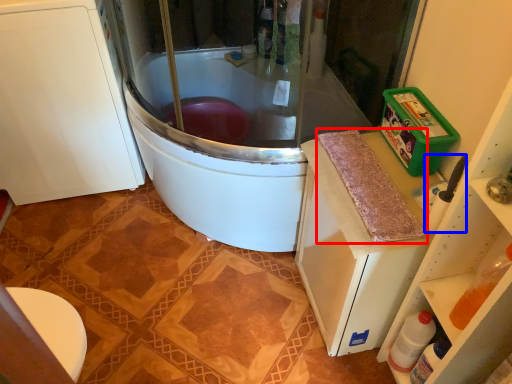
Question: Among these objects, which one is farthest to the camera, material (highlighted by a red box) or appliance (highlighted by a blue box)?

Choices:
 (A) material
 (B) appliance

Answer: (A)